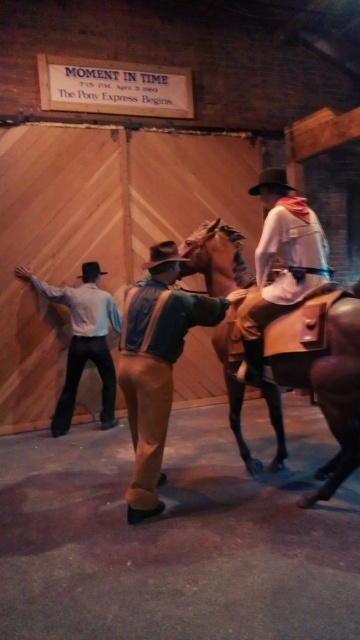
From the picture: Which is above, denim jacket at center or leather jacket at center?

leather jacket at center

Does denim jacket at center have a lesser height compared to leather jacket at center?

No.

Between point (164, 358) and point (326, 275), which one is positioned in front?

Point (164, 358)

This screenshot has height=640, width=360. Find the location of `denim jacket at center`. denim jacket at center is located at coordinates (156, 365).

Does denim jacket at center appear on the left side of light blue shirt at left?

In fact, denim jacket at center is to the right of light blue shirt at left.

Does point (151, 256) lie in front of point (82, 333)?

Yes, point (151, 256) is in front of point (82, 333).

Locate an element on the screen. denim jacket at center is located at coordinates (156, 365).

Is brown leather horse at center closer to the viewer compared to denim jacket at center?

Yes, it is.

Is brown leather horse at center positioned behind denim jacket at center?

No, it is not.

The image size is (360, 640). Identify the location of brown leather horse at center. (325, 378).